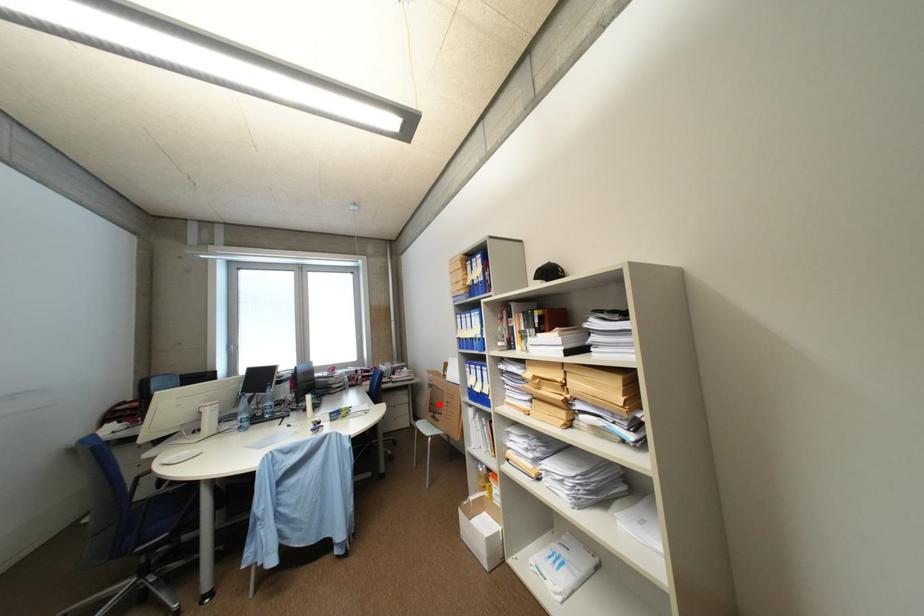
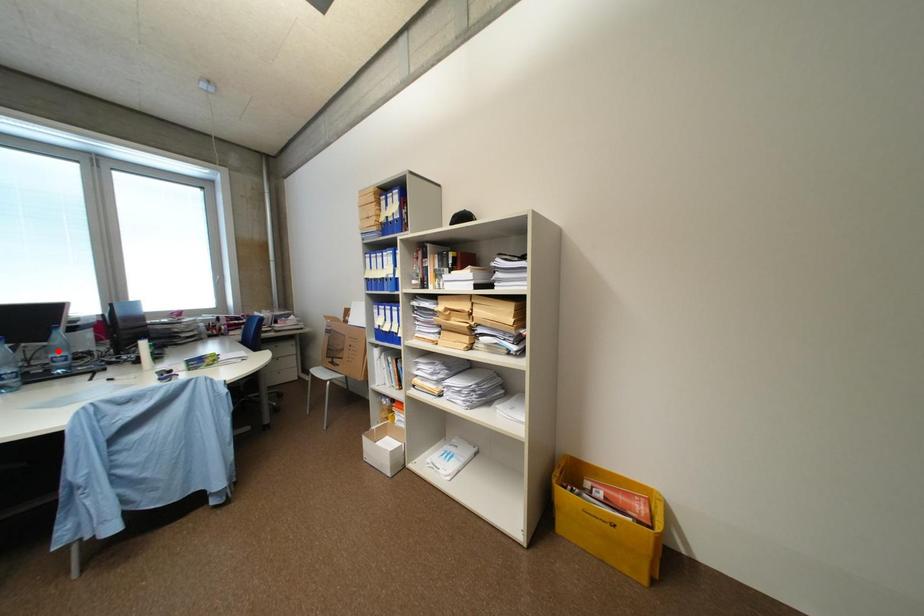
Based on the photo, I am providing you with two images of the same scene from different viewpoints. A red point is marked on the first image and another point is marked on the second image. Is the marked point in image1 the same physical position as the marked point in image2?

No